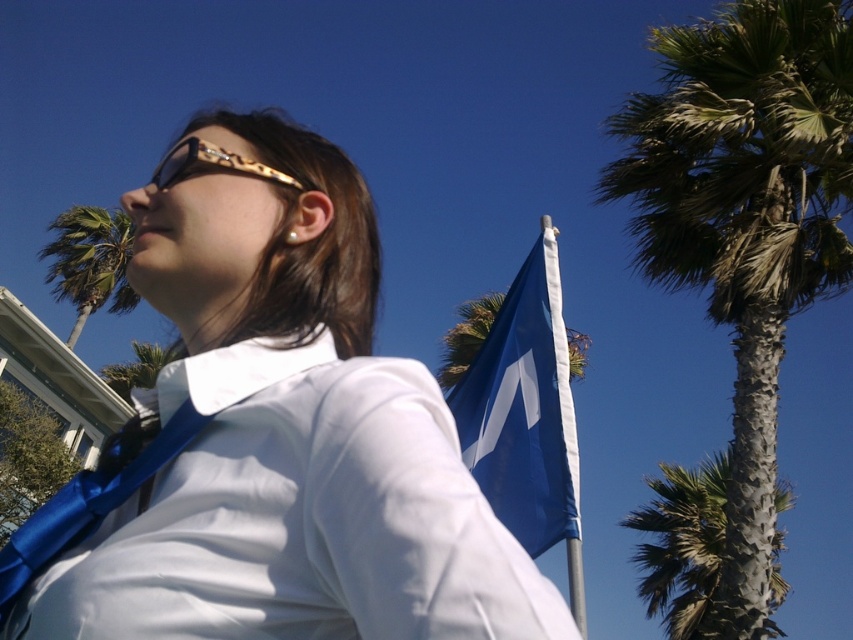
You are standing in the park and see the blue fabric flag at upper right and the green leafy palm tree at left. Which object is positioned higher in the sky?

The green leafy palm tree at left is positioned higher in the sky than the blue fabric flag at upper right.

You are standing in the outdoor scene and want to take a photo of the blue fabric flag at upper right without the green leafy palm tree at upper right blocking it. How should you adjust your position?

Move to the left so that the blue fabric flag at upper right is no longer behind the green leafy palm tree at upper right, since the palm tree is closer to you and blocking the view of the flag.